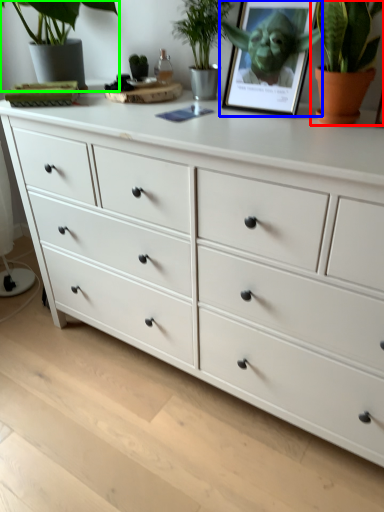
Question: Estimate the real-world distances between objects in this image. Which object is closer to houseplant (highlighted by a red box), picture frame (highlighted by a blue box) or houseplant (highlighted by a green box)?

Choices:
 (A) picture frame
 (B) houseplant

Answer: (A)